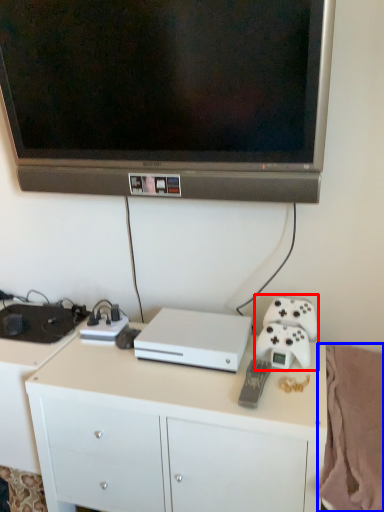
Question: Among these objects, which one is farthest to the camera, game controller (highlighted by a red box) or blanket (highlighted by a blue box)?

Choices:
 (A) game controller
 (B) blanket

Answer: (A)